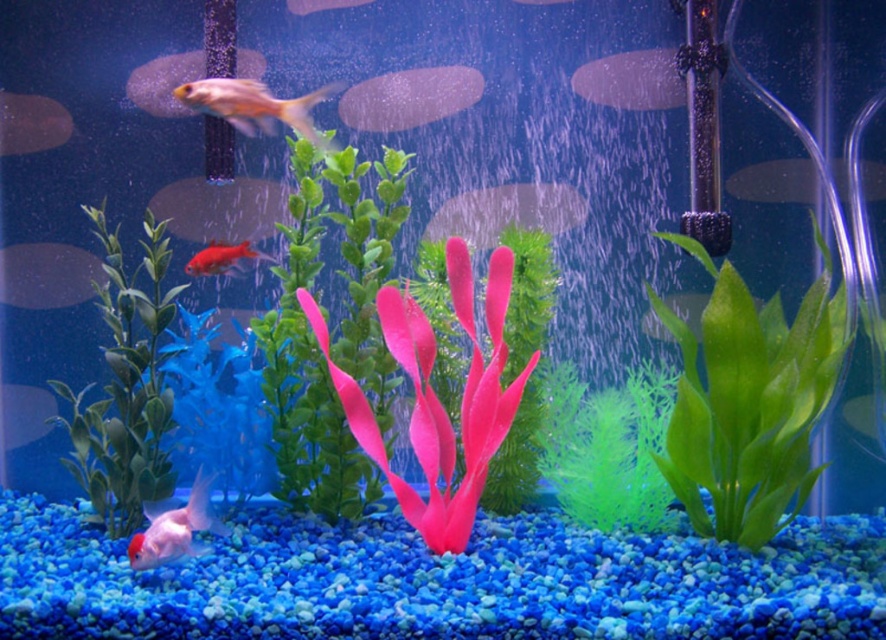
Who is more distant from viewer, (6, 253) or (269, 257)?

The point (6, 253) is more distant.

Based on the photo, between gold matte fish at lower left and glossy red goldfish at center, which one is positioned lower?

gold matte fish at lower left is below.

Is point (22, 289) less distant than point (216, 264)?

No, it is not.

This screenshot has height=640, width=886. What are the coordinates of `gold matte fish at lower left` in the screenshot? It's located at (47, 275).

Which of these two, green matte plant at left or translucent glass fish at upper right, stands shorter?

translucent glass fish at upper right

Can you confirm if green matte plant at left is positioned below translucent glass fish at upper right?

Correct, green matte plant at left is located below translucent glass fish at upper right.

Identify the location of green matte plant at left. (125, 387).

Who is positioned more to the right, translucent glass fish at upper right or gold matte fish at upper left?

Positioned to the right is translucent glass fish at upper right.

Is the position of translucent glass fish at upper right less distant than that of gold matte fish at upper left?

That is True.

Describe the element at coordinates (775, 180) in the screenshot. I see `translucent glass fish at upper right` at that location.

Where is `translucent glass fish at upper right`? The height and width of the screenshot is (640, 886). translucent glass fish at upper right is located at coordinates (775, 180).